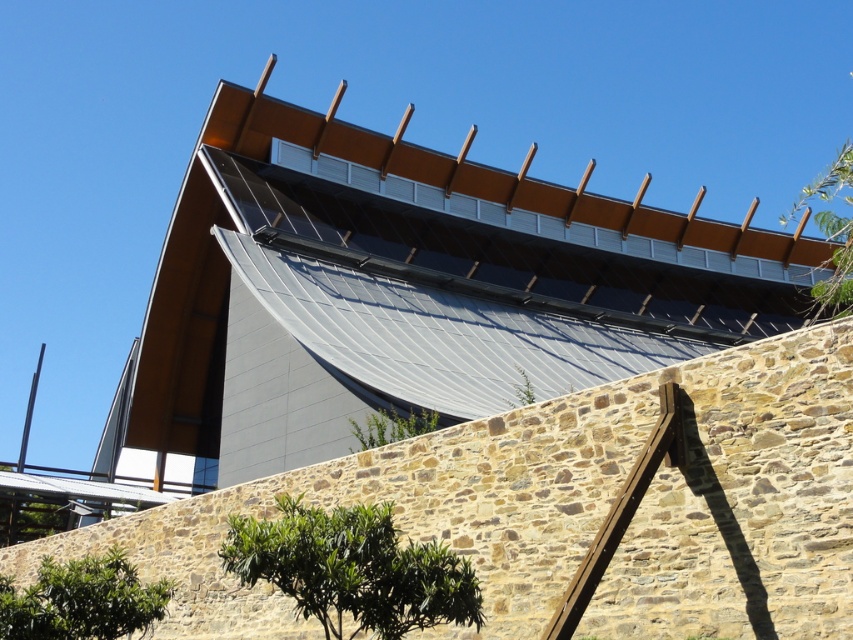
You are standing in front of the modern architectural structure and want to walk towards the green leafy tree at lower center and the green leafy tree at lower left. Which tree should you walk towards if you want to reach the one that is closer to you first?

You should walk towards the green leafy tree at lower center because it is closer to the viewer than the green leafy tree at lower left.

You are standing in front of the modern building and want to determine the relative positions of two points marked on the structure. Which point, point (325,513) or point (77,618), is closer to you?

Point (325,513) is closer to the viewer than point (77,618).

You are standing in front of the modern building and want to know if the metallic gray roof at upper center is visible from the front entrance. Considering the green leafy tree at upper right, can you determine if the roof is obscured?

The metallic gray roof at upper center is positioned under the green leafy tree at upper right, so the tree may partially or fully block the view of the roof from the front entrance depending on the tree canopy density and the exact positioning of the entrance.